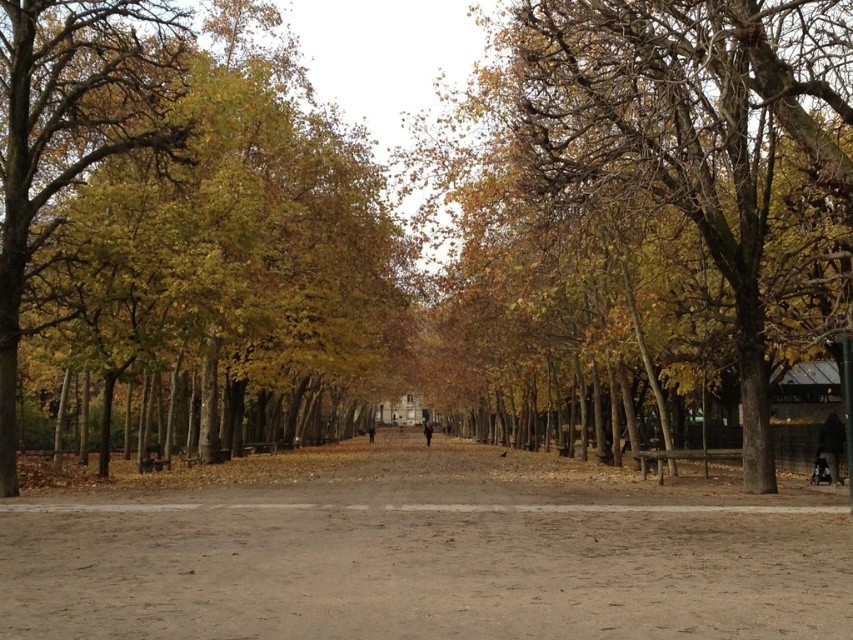
Is point (693, 202) less distant than point (62, 42)?

Yes, point (693, 202) is in front of point (62, 42).

Is brown textured tree at center to the left of yellow/golden leaves at left from the viewer's perspective?

In fact, brown textured tree at center is to the right of yellow/golden leaves at left.

In order to click on brown textured tree at center in this screenshot , I will do [654, 177].

You are a GUI agent. You are given a task and a screenshot of the screen. Output one action in this format:
    pyautogui.click(x=<x>, y=<y>)
    Task: Click on the brown textured tree at center
    The width and height of the screenshot is (853, 640).
    Given the screenshot: What is the action you would take?
    click(654, 177)

Between brown dirt path at center and brown textured tree at center, which one has more height?

Standing taller between the two is brown textured tree at center.

Find the location of `brown dirt path at center`. brown dirt path at center is located at coordinates (427, 554).

This screenshot has height=640, width=853. I want to click on brown dirt path at center, so click(427, 554).

Is brown dirt path at center to the left of yellow/golden leaves at left from the viewer's perspective?

In fact, brown dirt path at center is to the right of yellow/golden leaves at left.

Does brown dirt path at center have a greater height compared to yellow/golden leaves at left?

No.

The height and width of the screenshot is (640, 853). What do you see at coordinates (427, 554) in the screenshot?
I see `brown dirt path at center` at bounding box center [427, 554].

This screenshot has height=640, width=853. Identify the location of brown dirt path at center. (427, 554).